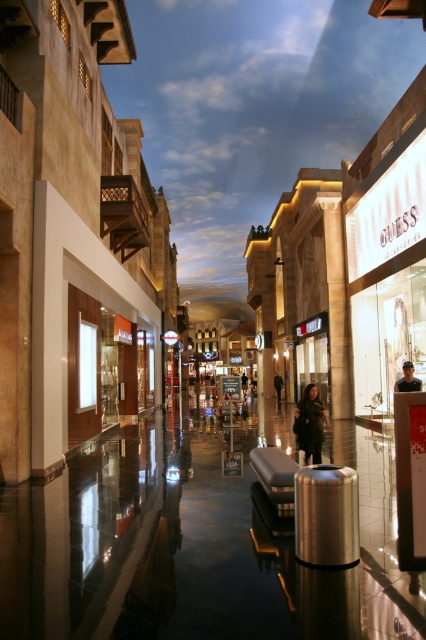
You are a customer browsing the Guess store and see both the dark green leather jacket at center and the light brown leather jacket at center displayed in the window. Which jacket is hanging higher up?

The dark green leather jacket at center is positioned under the light brown leather jacket at center, so the light brown one is hanging higher up.

You are standing in the shopping arcade and see two leather jackets displayed at the center. Which jacket is nearer to you, the dark green leather jacket at center or the light brown leather jacket at center?

The dark green leather jacket at center is closer to the viewer than the light brown leather jacket at center.

You are a customer in the shopping arcade looking at the jackets displayed in the center. Which jacket is positioned higher between the dark green leather jacket at center and the dark brown leather jacket at center?

The dark green leather jacket at center is positioned higher than the dark brown leather jacket at center.